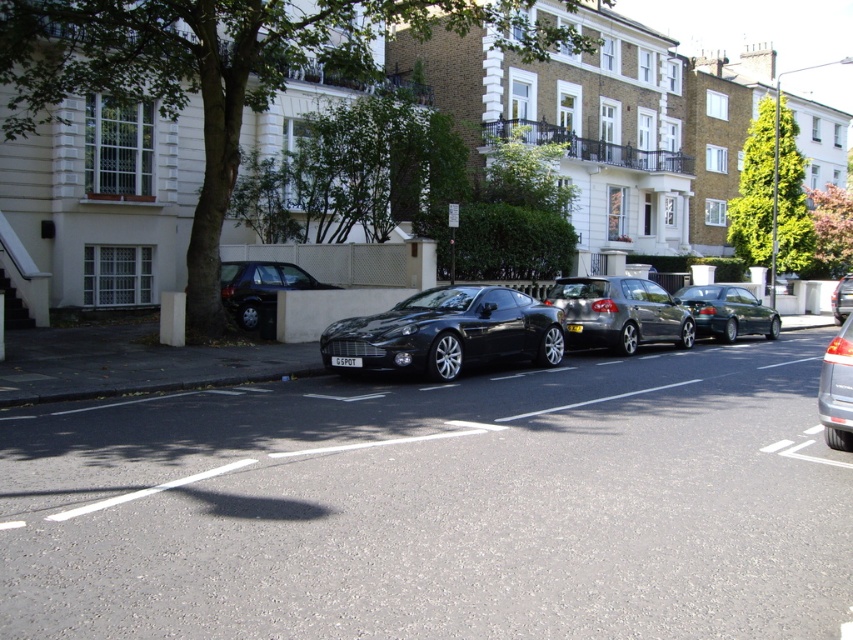
Question: Can you confirm if black glossy car at center is thinner than satin silver sedan at center?

Choices:
 (A) no
 (B) yes

Answer: (A)

Question: Which point is farther to the camera?

Choices:
 (A) shiny black sedan at center
 (B) black glossy car at center
 (C) metallic silver car at right

Answer: (A)

Question: Among these objects, which one is farthest from the camera?

Choices:
 (A) satin silver sedan at center
 (B) shiny silver car at center

Answer: (B)

Question: Is satin silver sedan at center smaller than black metallic license plate at center?

Choices:
 (A) yes
 (B) no

Answer: (B)

Question: Does shiny silver car at center have a smaller size compared to white plastic license plate at center?

Choices:
 (A) yes
 (B) no

Answer: (B)

Question: Which object appears closest to the camera in this image?

Choices:
 (A) black glossy car at center
 (B) metallic silver car at right
 (C) metallic gray sedan at center
 (D) black metallic license plate at center

Answer: (B)